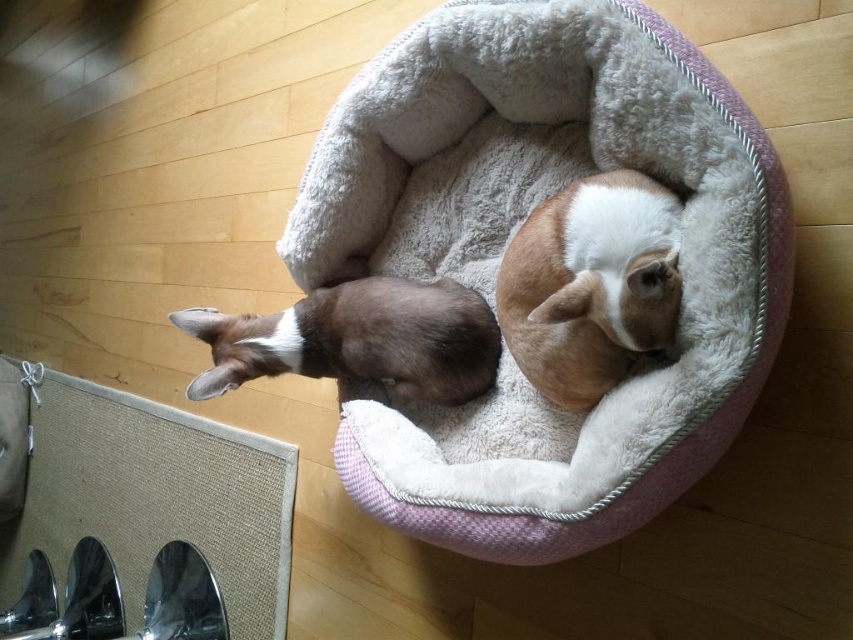
You are a cat trying to jump onto the soft gray plush cat bed at center and the brown fuzzy dog at center. Which one is closer to you?

The soft gray plush cat bed at center is further away than the brown fuzzy dog at center, so the brown fuzzy dog at center is closer to you.